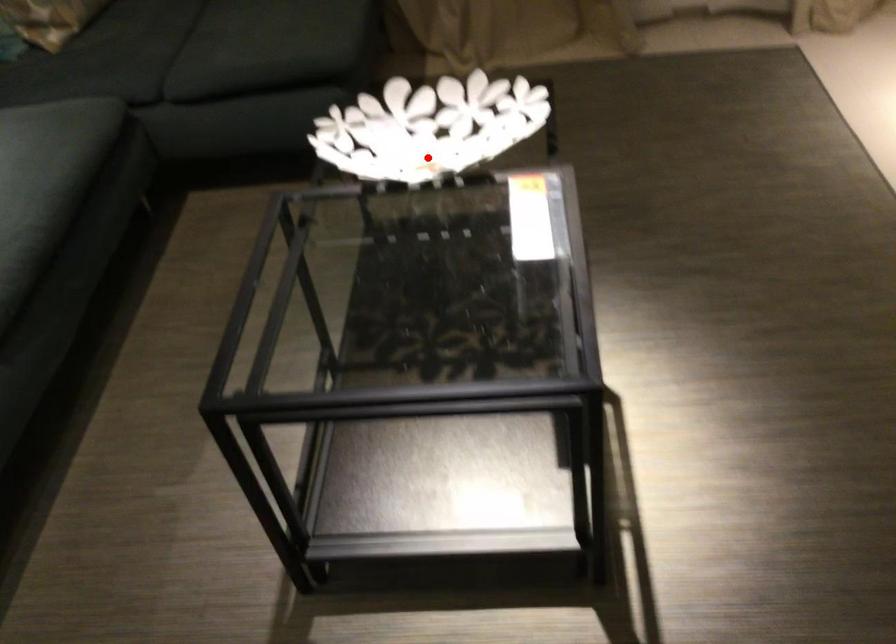
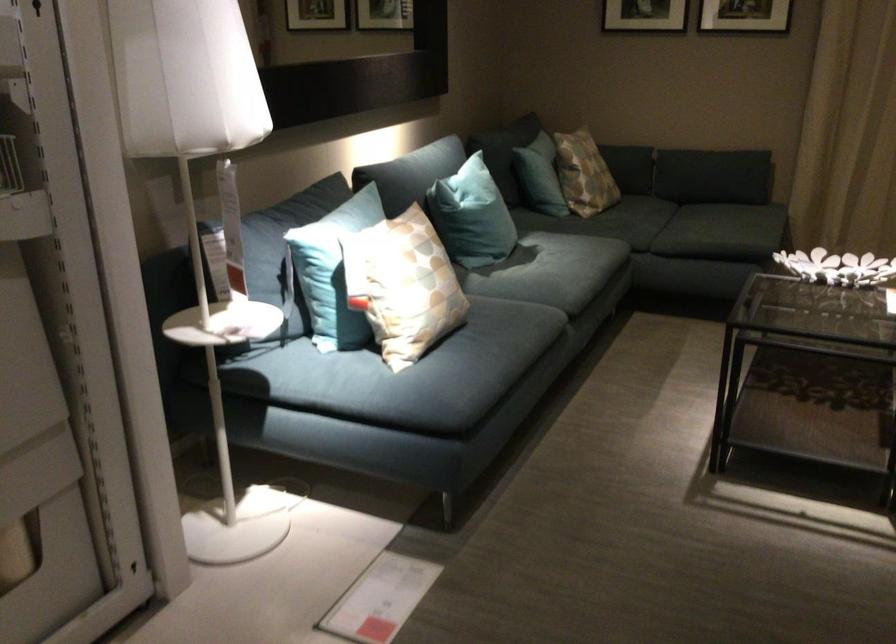
The point at the highlighted location is marked in the first image. Where is the corresponding point in the second image?

(837, 267)